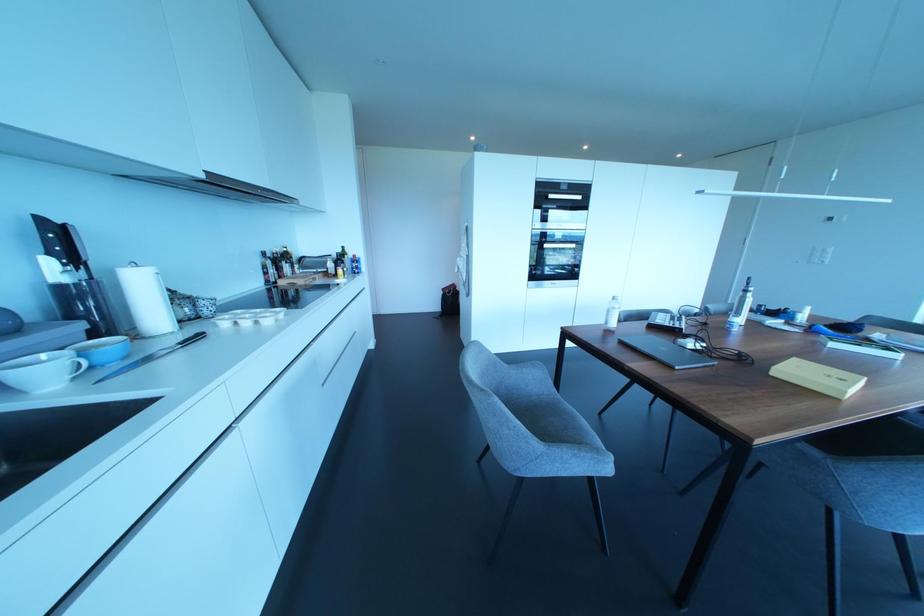
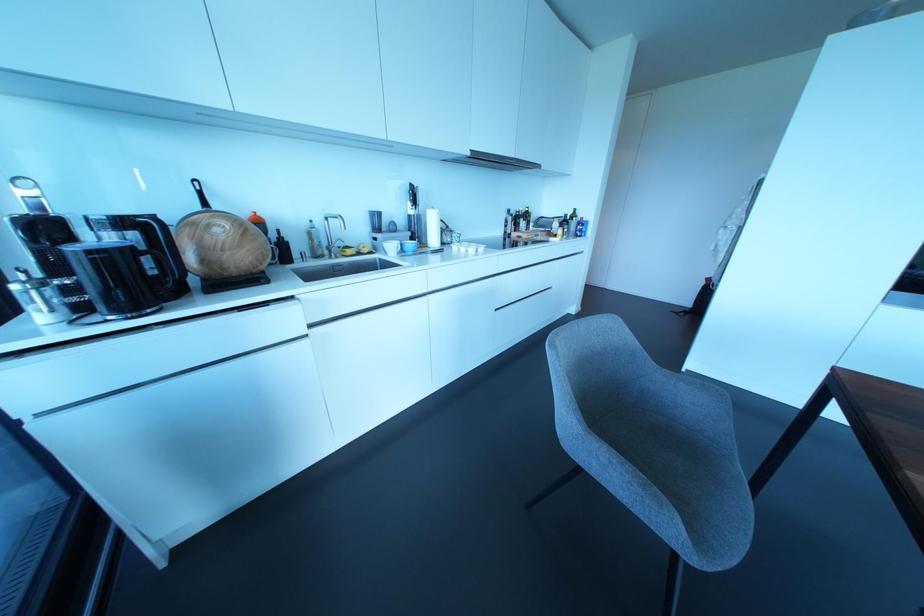
Where in the second image is the point corresponding to [246,323] from the first image?

(462, 249)